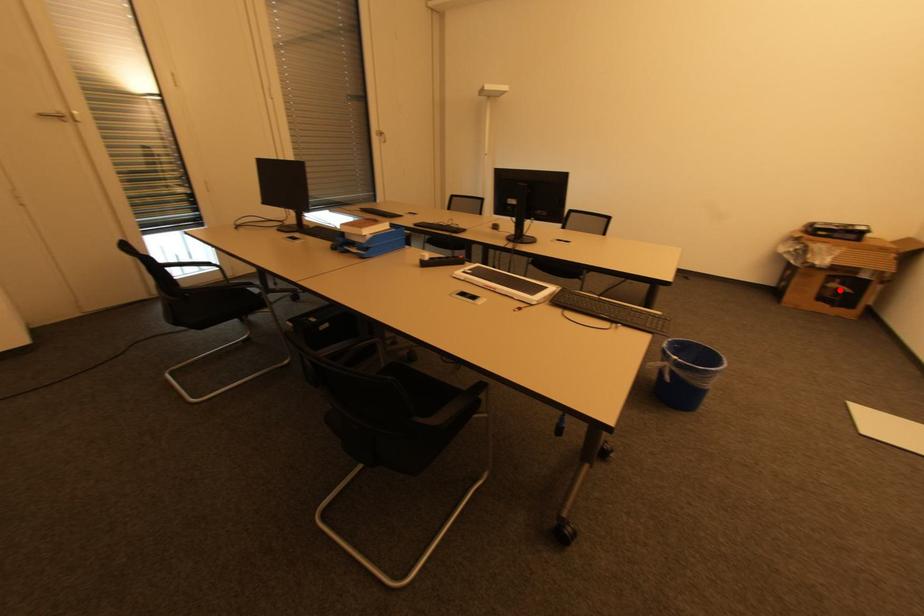
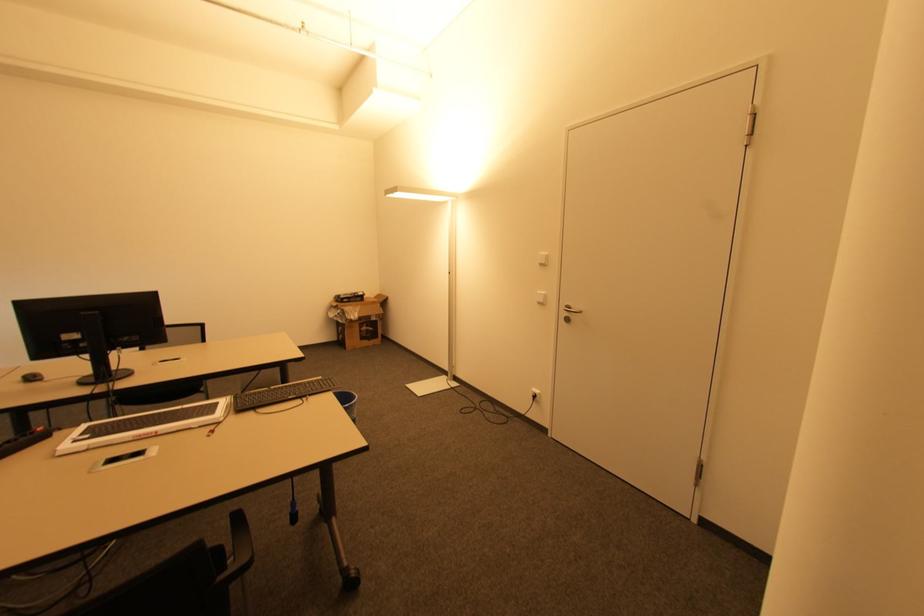
Question: I am providing you with two images of the same scene from different viewpoints. Image1 has a red point marked. In image2, the corresponding 3D location appears at what relative position? Reply with the corresponding letter.

Choices:
 (A) Closer
 (B) Farther

Answer: (A)